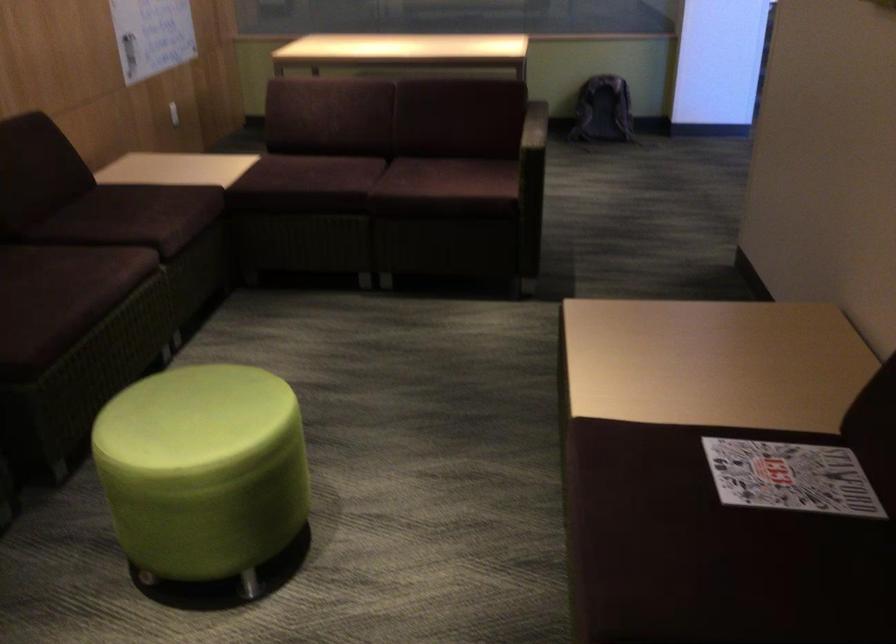
This screenshot has height=644, width=896. What are the coordinates of `black backpack` in the screenshot? It's located at (602, 109).